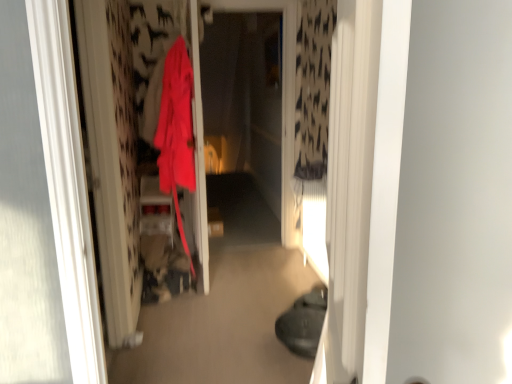
Question: From the image's perspective, does transparent plastic screen door at center appear lower than matte red coat at center?

Choices:
 (A) no
 (B) yes

Answer: (A)

Question: Is transparent plastic screen door at center in front of matte red coat at center?

Choices:
 (A) no
 (B) yes

Answer: (A)

Question: Is the depth of transparent plastic screen door at center greater than that of matte red coat at center?

Choices:
 (A) yes
 (B) no

Answer: (A)

Question: Are transparent plastic screen door at center and matte red coat at center located far from each other?

Choices:
 (A) yes
 (B) no

Answer: (A)

Question: Is transparent plastic screen door at center smaller than matte red coat at center?

Choices:
 (A) no
 (B) yes

Answer: (B)

Question: Is transparent plastic screen door at center to the right of matte red coat at center from the viewer's perspective?

Choices:
 (A) no
 (B) yes

Answer: (B)

Question: Is the position of matte red coat at center less distant than that of transparent plastic screen door at center?

Choices:
 (A) no
 (B) yes

Answer: (B)

Question: From the image's perspective, does matte red coat at center appear lower than transparent plastic screen door at center?

Choices:
 (A) no
 (B) yes

Answer: (B)

Question: Is matte red coat at center wider than transparent plastic screen door at center?

Choices:
 (A) no
 (B) yes

Answer: (B)

Question: Considering the relative sizes of matte red coat at center and transparent plastic screen door at center in the image provided, is matte red coat at center shorter than transparent plastic screen door at center?

Choices:
 (A) no
 (B) yes

Answer: (B)

Question: From a real-world perspective, does matte red coat at center sit lower than transparent plastic screen door at center?

Choices:
 (A) no
 (B) yes

Answer: (B)

Question: From a real-world perspective, does matte red coat at center stand above transparent plastic screen door at center?

Choices:
 (A) no
 (B) yes

Answer: (A)

Question: Considering the positions of matte red coat at center and transparent plastic screen door at center in the image, is matte red coat at center bigger or smaller than transparent plastic screen door at center?

Choices:
 (A) small
 (B) big

Answer: (B)